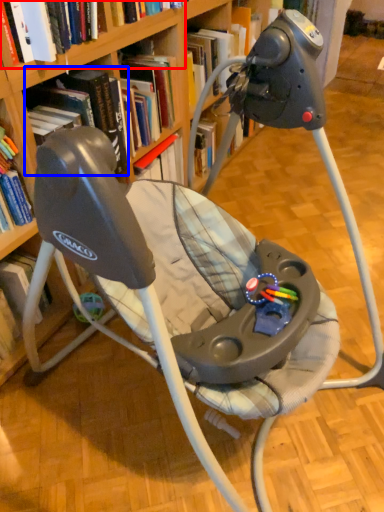
Question: Which object is closer to the camera taking this photo, book (highlighted by a red box) or book (highlighted by a blue box)?

Choices:
 (A) book
 (B) book

Answer: (A)